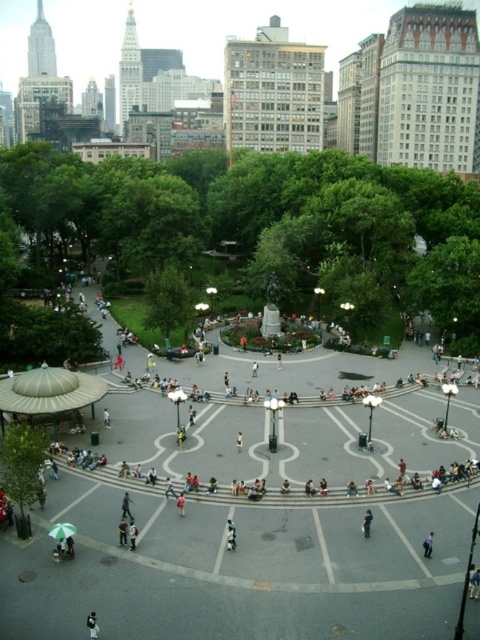
You are standing at the point labeled point (92, 625) in the park. What object is located at that point?

The point (92, 625) corresponds to the dark gray fabric jacket at center.

You are a photographer planning to capture a photo of the dark gray fabric jacket at center and the light blue shirt at lower right in the urban park scene. Considering their sizes, which object would appear bigger in your photo?

The dark gray fabric jacket at center would appear bigger in the photo because it has a larger size compared to the light blue shirt at lower right.